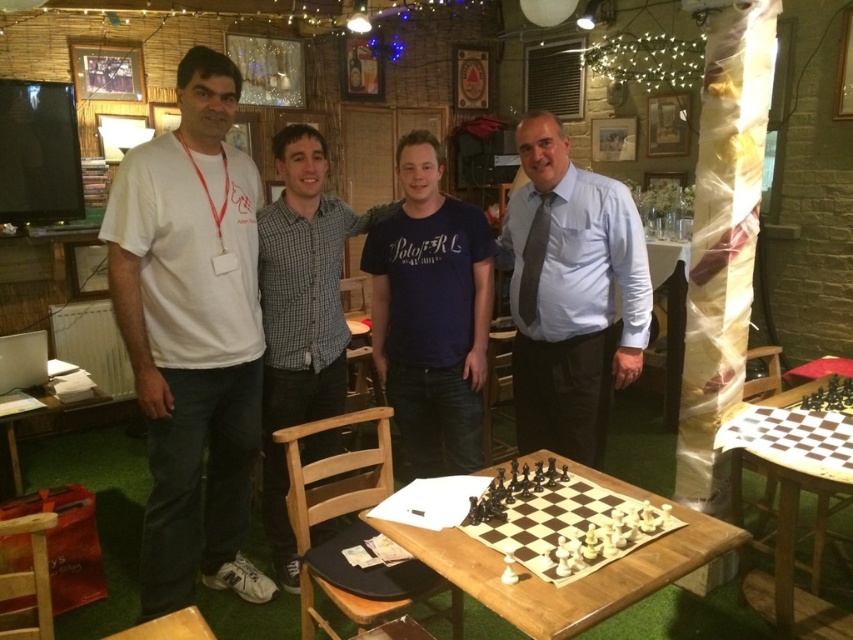
Question: Which point is closer to the camera?

Choices:
 (A) (291, 200)
 (B) (792, 524)
 (C) (1, 397)
 (D) (142, 612)

Answer: (B)

Question: Can you confirm if white cotton t-shirt at left is bigger than wooden table at lower left?

Choices:
 (A) no
 (B) yes

Answer: (B)

Question: Is checkered shirt at center further to camera compared to wooden chessboard at lower right?

Choices:
 (A) no
 (B) yes

Answer: (B)

Question: Which point appears farthest from the camera in this image?

Choices:
 (A) (712, 529)
 (B) (590, 360)
 (C) (553, 460)

Answer: (B)

Question: Can you confirm if white cotton t-shirt at left is positioned to the left of wooden chessboard at center?

Choices:
 (A) yes
 (B) no

Answer: (A)

Question: Which object appears closest to the camera in this image?

Choices:
 (A) white cotton t-shirt at left
 (B) checkered shirt at center
 (C) wooden chessboard at lower right
 (D) wooden chessboard at center

Answer: (D)